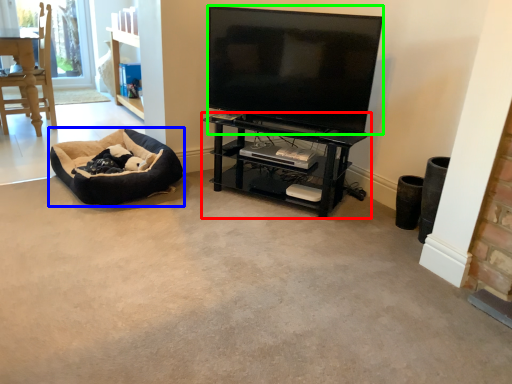
Question: Based on their relative distances, which object is nearer to shelf (highlighted by a red box)? Choose from dog bed (highlighted by a blue box) and television (highlighted by a green box).

Choices:
 (A) dog bed
 (B) television

Answer: (B)